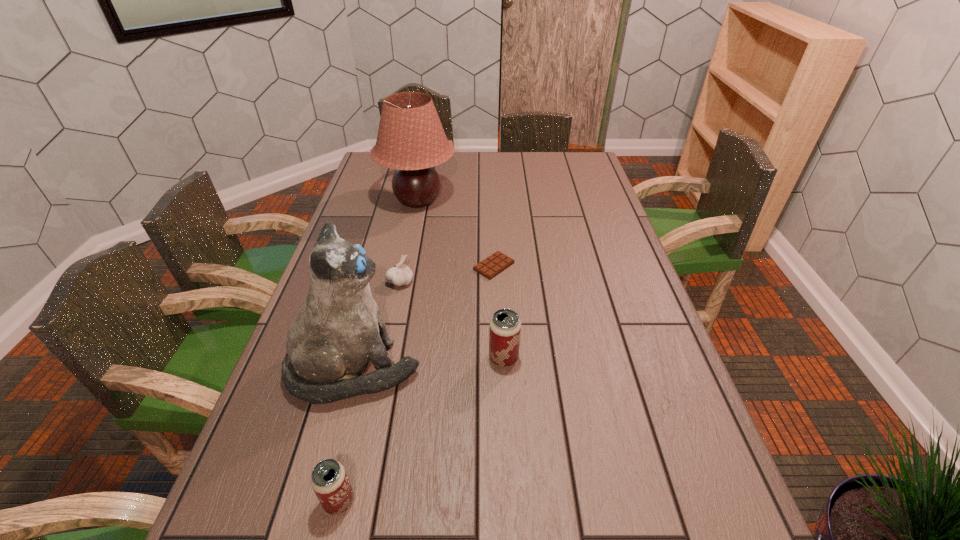
Where is `free space at the far left corner of the desktop`? free space at the far left corner of the desktop is located at coordinates (381, 172).

Identify the location of vacant area at the near right corner. (661, 464).

Identify the location of empty space between the shortest object and the cat. (424, 318).

Where is `free space between the taller beer can and the lampshade`? Image resolution: width=960 pixels, height=540 pixels. free space between the taller beer can and the lampshade is located at coordinates (461, 279).

Where is `vacant area that lies between the cat and the lampshade`? vacant area that lies between the cat and the lampshade is located at coordinates (386, 285).

Where is `vacant area that lies between the cat and the right beer can`? The height and width of the screenshot is (540, 960). vacant area that lies between the cat and the right beer can is located at coordinates (429, 363).

The height and width of the screenshot is (540, 960). What are the coordinates of `vacant point located between the lampshade and the taller beer can` in the screenshot? It's located at (461, 279).

Locate an element on the screen. The width and height of the screenshot is (960, 540). blank region between the second shortest object and the lampshade is located at coordinates (409, 241).

Identify the location of object that is the closest to the lampshade. Image resolution: width=960 pixels, height=540 pixels. (496, 263).

Identify which object is the fifth closest to the fifth tallest object. Please provide its 2D coordinates. Your answer should be formatted as a tuple, i.e. [(x, y)], where the tuple contains the x and y coordinates of a point satisfying the conditions above.

[(329, 480)]